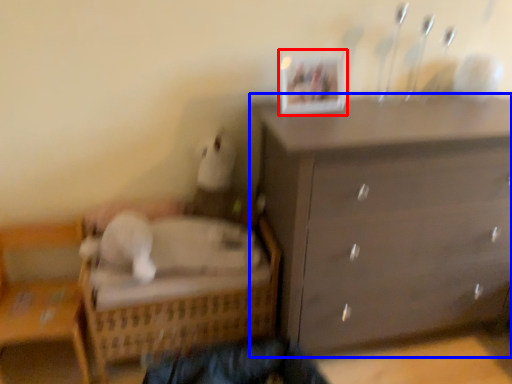
Question: Which object is further to the camera taking this photo, picture frame (highlighted by a red box) or chest of drawers (highlighted by a blue box)?

Choices:
 (A) picture frame
 (B) chest of drawers

Answer: (A)